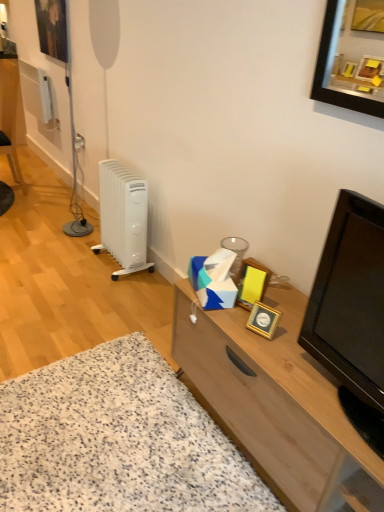
Find the location of a particular element. free space in front of gold metallic picture frame at center-right, the second picture frame in the left-to-right sequence is located at coordinates (261, 337).